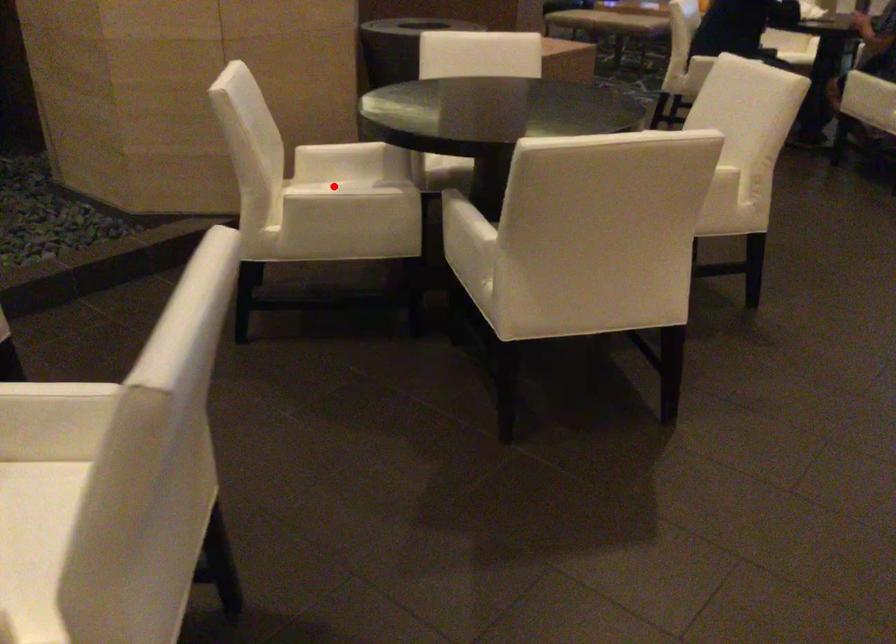
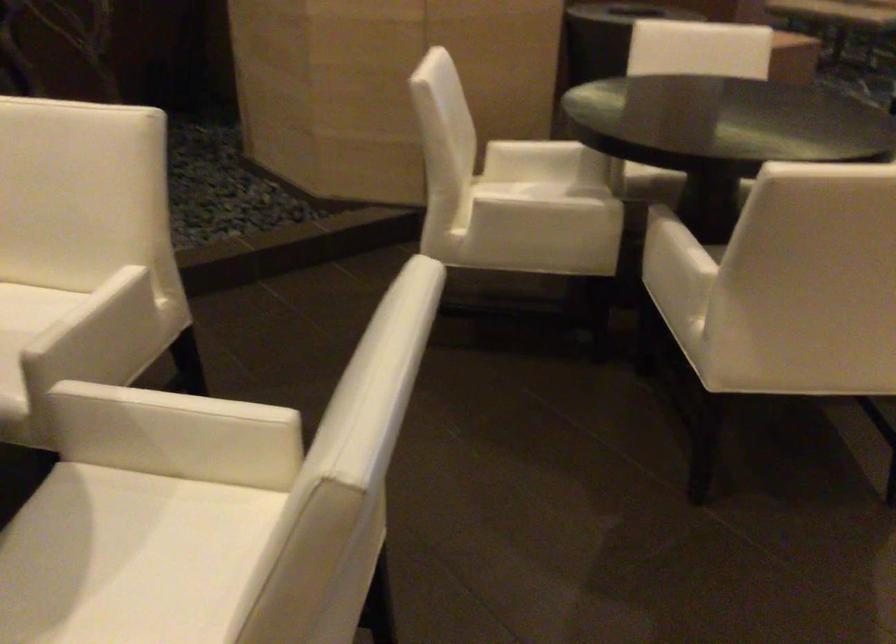
Find the pixel in the second image that matches the highlighted location in the first image.

(530, 189)